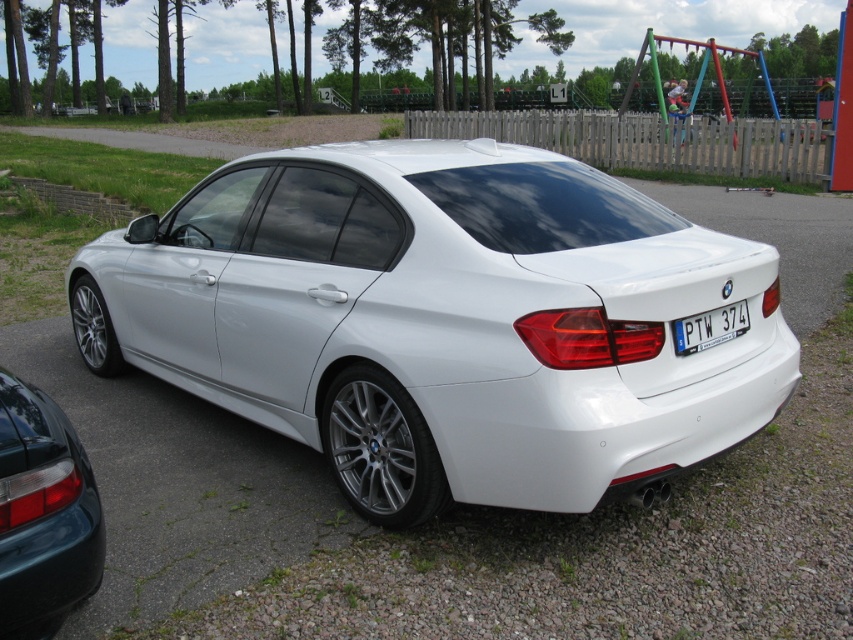
You are a delivery driver who needs to park your vehicle in the parking lot. You see the white glossy sedan at center and the brick at lower left. Which object is closer to the entrance of the parking lot?

The brick at lower left is closer to the entrance of the parking lot because the white glossy sedan at center is located below it, meaning the brick is positioned higher up near the entrance area.

You are a parking attendant checking the alignment of vehicles. You notice the teal glossy taillight at lower left and the white glossy car at center. Which object is positioned lower in the image?

The teal glossy taillight at lower left is positioned below the white glossy car at center, so it is lower in the image.